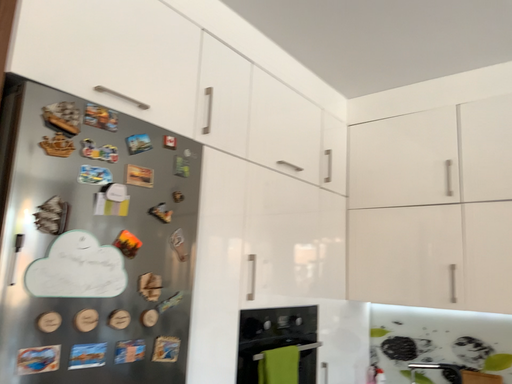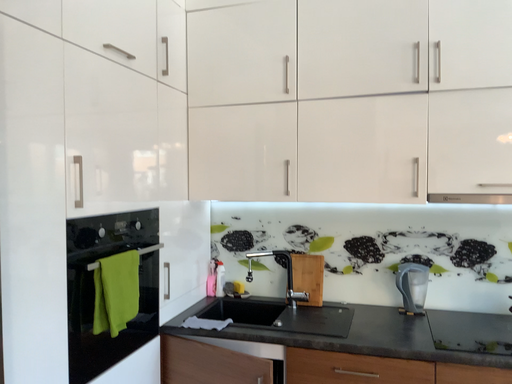
Question: Which way did the camera rotate in the video?

Choices:
 (A) rotated downward
 (B) rotated upward

Answer: (A)